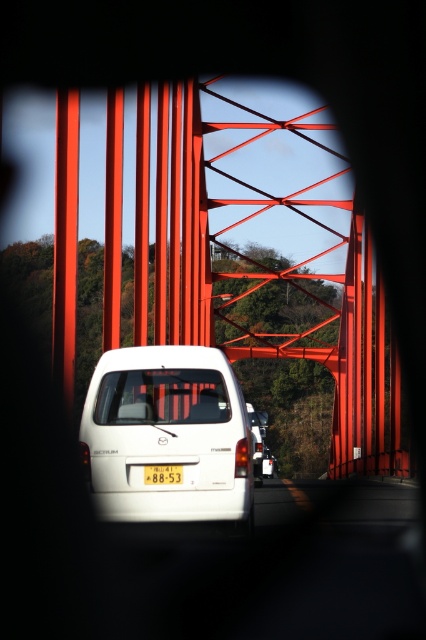
Which is below, metallic red bridge at center or white matte van at center?

white matte van at center

Consider the image. Is metallic red bridge at center above white matte van at center?

Correct, metallic red bridge at center is located above white matte van at center.

Between point (114, 93) and point (101, 371), which one is positioned behind?

The point (114, 93) is behind.

Find the location of `metallic red bridge at center`. metallic red bridge at center is located at coordinates (273, 273).

Who is positioned more to the right, metallic red bridge at center or yellow plastic license plate at center?

metallic red bridge at center

Between metallic red bridge at center and yellow plastic license plate at center, which one is positioned lower?

yellow plastic license plate at center is lower down.

This screenshot has height=640, width=426. I want to click on metallic red bridge at center, so click(273, 273).

Describe the element at coordinates (166, 435) in the screenshot. I see `white matte van at center` at that location.

Is white matte van at center smaller than yellow plastic license plate at center?

No, white matte van at center is not smaller than yellow plastic license plate at center.

Who is more forward, (175, 422) or (166, 477)?

Point (175, 422) is more forward.

Locate an element on the screen. The height and width of the screenshot is (640, 426). white matte van at center is located at coordinates (166, 435).